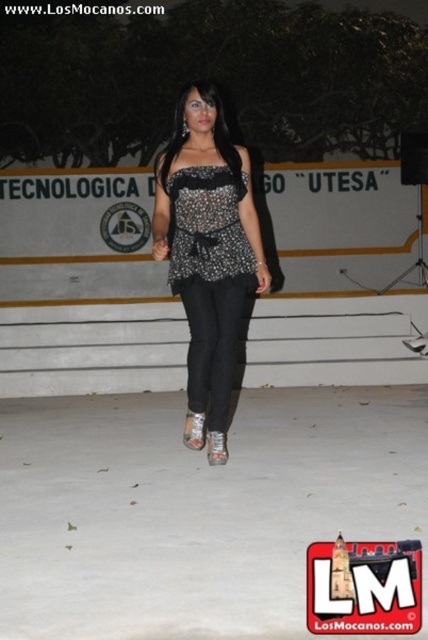
Question: Is sparkly black top at center positioned behind sparkly sequined dress at center?

Choices:
 (A) yes
 (B) no

Answer: (B)

Question: Does sparkly black top at center come in front of sparkly sequined dress at center?

Choices:
 (A) no
 (B) yes

Answer: (B)

Question: From the image, what is the correct spatial relationship of sparkly black top at center in relation to sparkly sequined dress at center?

Choices:
 (A) below
 (B) above

Answer: (A)

Question: Among these points, which one is farthest from the camera?

Choices:
 (A) (237, 189)
 (B) (232, 205)

Answer: (B)